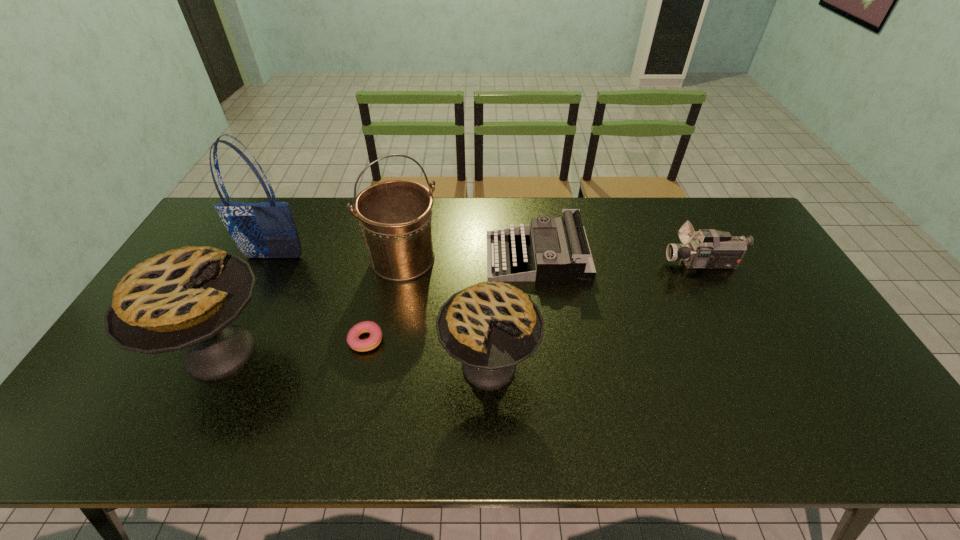
Where is `the third tallest object`? The width and height of the screenshot is (960, 540). the third tallest object is located at coordinates (188, 297).

Locate an element on the screen. the left pie is located at coordinates (188, 297).

This screenshot has height=540, width=960. What are the coordinates of `the right pie` in the screenshot? It's located at (490, 327).

Identify the location of the shorter pie. The height and width of the screenshot is (540, 960). (490, 327).

Image resolution: width=960 pixels, height=540 pixels. Find the location of `shopping bag`. shopping bag is located at coordinates (259, 230).

The image size is (960, 540). What are the coordinates of `the sixth tallest object` in the screenshot? It's located at (554, 249).

What are the coordinates of `bucket` in the screenshot? It's located at (395, 216).

The width and height of the screenshot is (960, 540). In order to click on the third shortest object in this screenshot , I will do `click(710, 249)`.

This screenshot has height=540, width=960. Identify the location of the rightmost object. (710, 249).

Where is `doughnut`? doughnut is located at coordinates (362, 345).